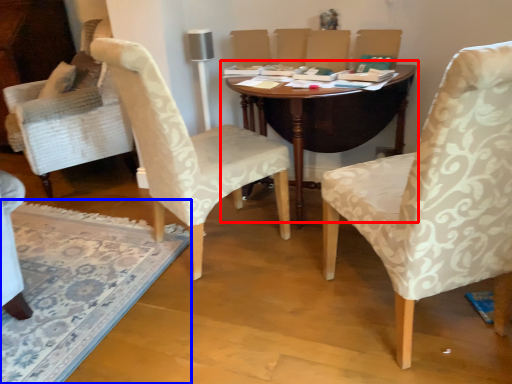
Question: Which point is closer to the camera, table (highlighted by a red box) or mat (highlighted by a blue box)?

Choices:
 (A) table
 (B) mat

Answer: (B)